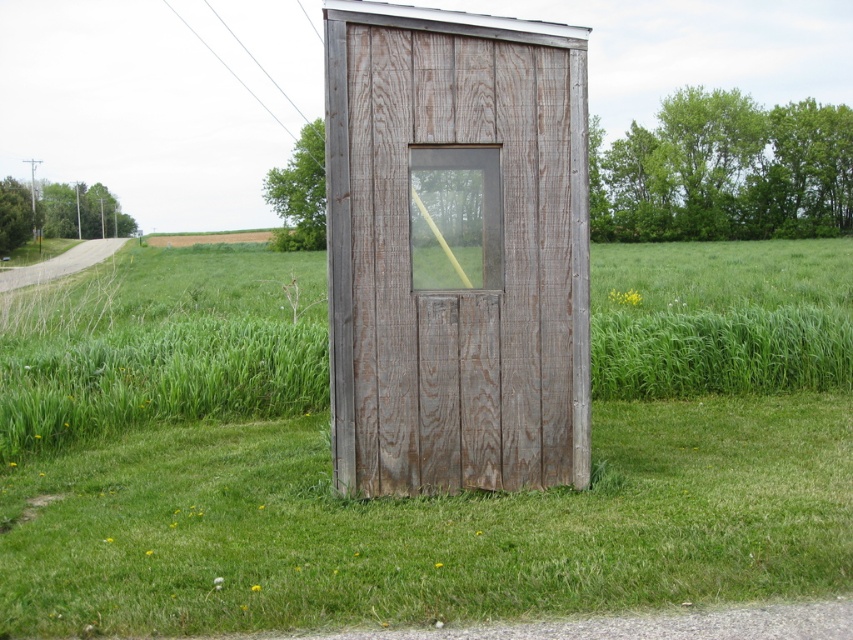
You are standing outside the weathered wood hut at center and want to see through the transparent plastic window at center. Can you see the window clearly?

The transparent plastic window at center is behind the weathered wood hut at center, so you cannot see it clearly from outside the weathered wood hut at center.

You are standing in front of the wooden shed at center and want to clean the transparent plastic window at center. Which direction should you move to reach the window?

The wooden shed at center is on the left side of the transparent plastic window at center, so you should move to the right to reach the window.